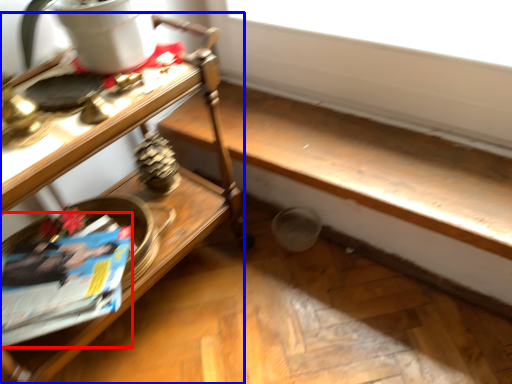
Question: Which point is closer to the camera, magazine (highlighted by a red box) or table (highlighted by a blue box)?

Choices:
 (A) magazine
 (B) table

Answer: (B)